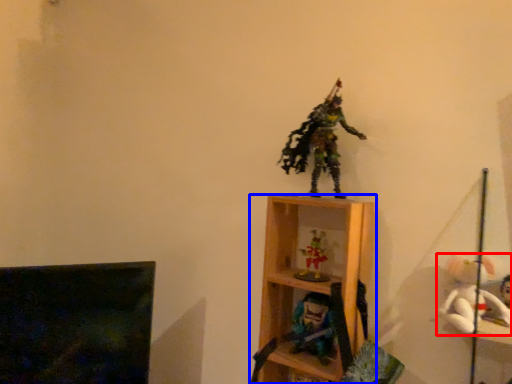
Question: Which of the following is the closest to the observer, toy (highlighted by a red box) or shelf (highlighted by a blue box)?

Choices:
 (A) toy
 (B) shelf

Answer: (A)